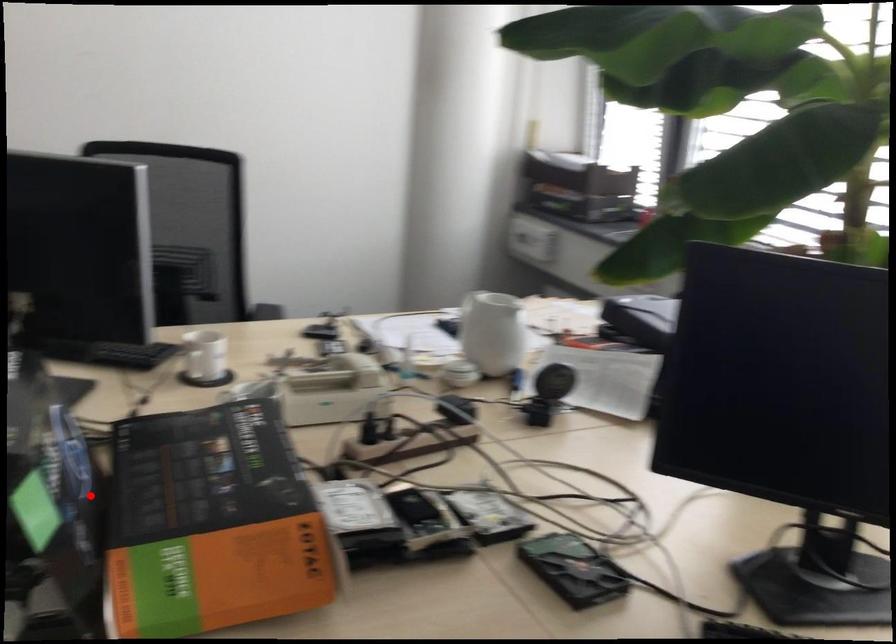
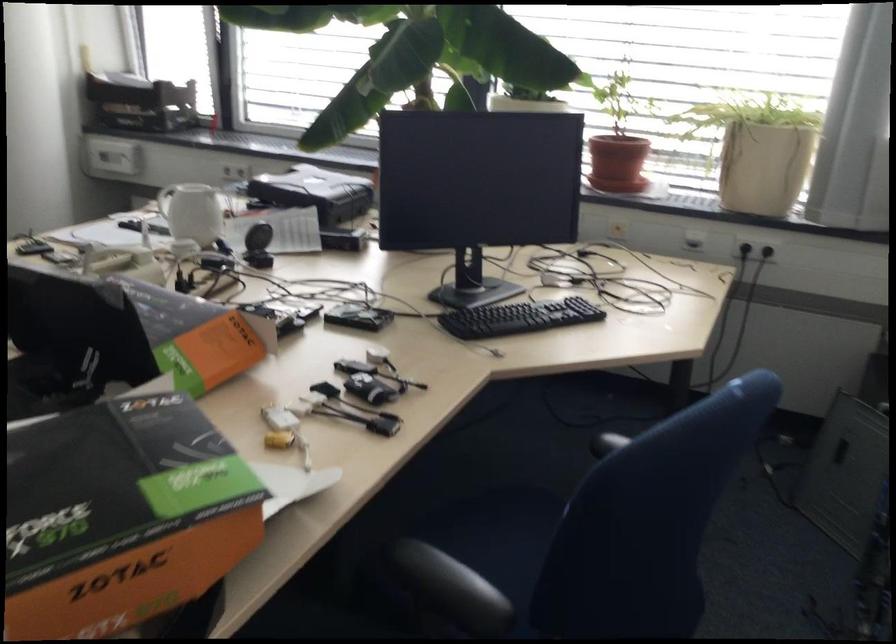
Where in the second image is the point corresponding to the highlighted location from the first image?

(108, 326)